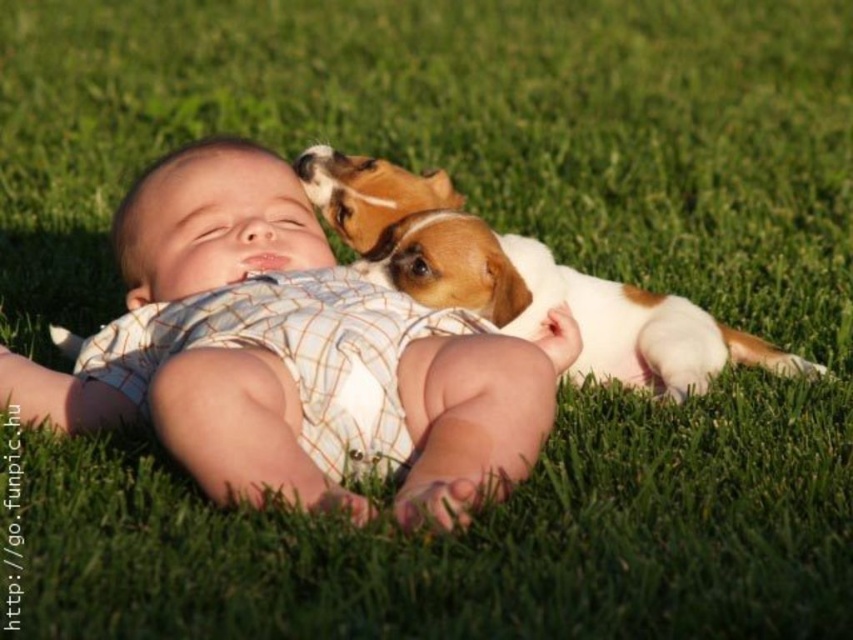
You are a photographer trying to capture a closeup of the matte white baby at center and the white fur dog at upper center. Since both subjects are in the same scene, which one would appear larger in your photo?

The matte white baby at center would appear larger in the photo because it is closer to the camera than the white fur dog at upper center.

Based on the coordinates provided, which object is located at point (293, 355)?

The point (293, 355) corresponds to the matte white baby at center.

You are a photographer trying to capture a closeup shot of the matte white baby at center and the white fur dog at upper center. Given that your camera can only focus on objects wider than 15 cm, will both subjects be in focus?

The matte white baby at center has a width less than the white fur dog at upper center. Since the camera requires objects wider than 15 cm to focus, only the white fur dog at upper center will be in focus if it meets the width requirement, but the matte white baby at center may not be wide enough. However, without specific measurements, we can only confirm the dog is wider than the baby, but cannot definitively say if either meets the 15 cm threshold.